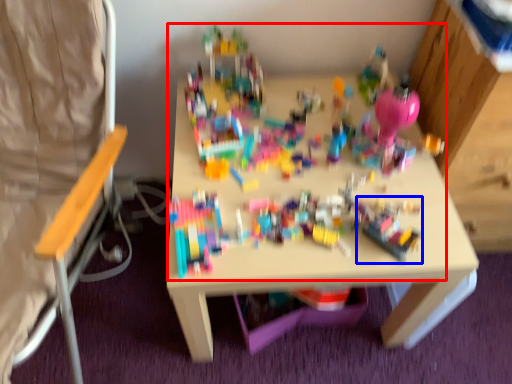
Question: Which of the following is the farthest to the observer, toy (highlighted by a red box) or toy (highlighted by a blue box)?

Choices:
 (A) toy
 (B) toy

Answer: (B)